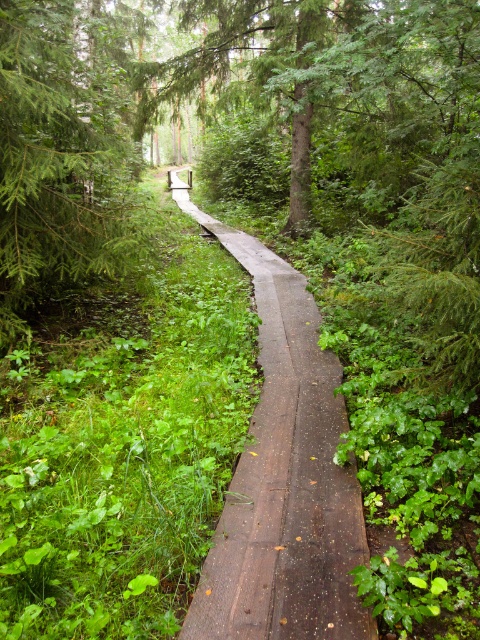
Where is `brown wooden path at center`? Image resolution: width=480 pixels, height=640 pixels. brown wooden path at center is located at coordinates (284, 480).

Between brown wooden path at center and green matte tree at upper left, which one is positioned higher?

green matte tree at upper left is higher up.

Between point (286, 339) and point (101, 26), which one is positioned behind?

The point (101, 26) is behind.

Locate an element on the screen. This screenshot has width=480, height=640. brown wooden path at center is located at coordinates (284, 480).